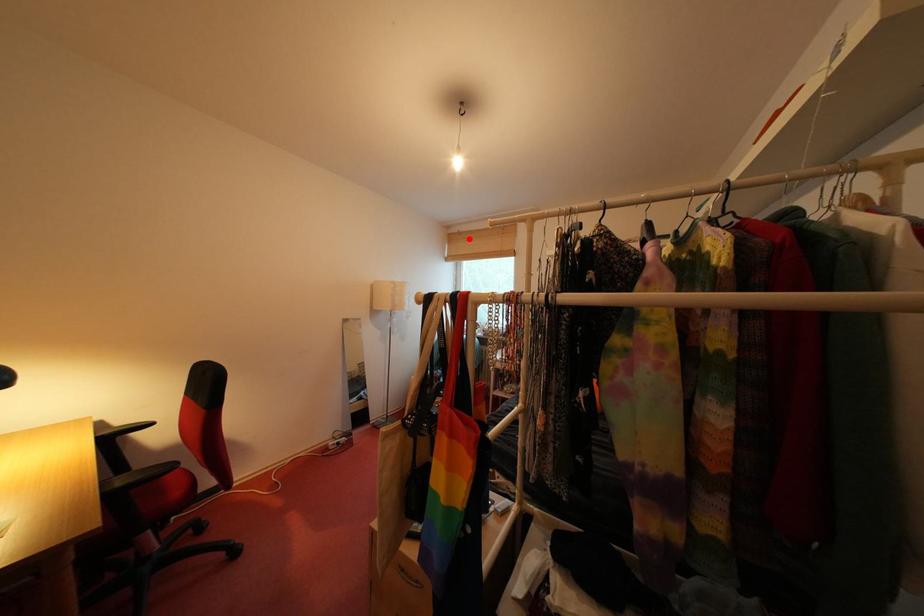
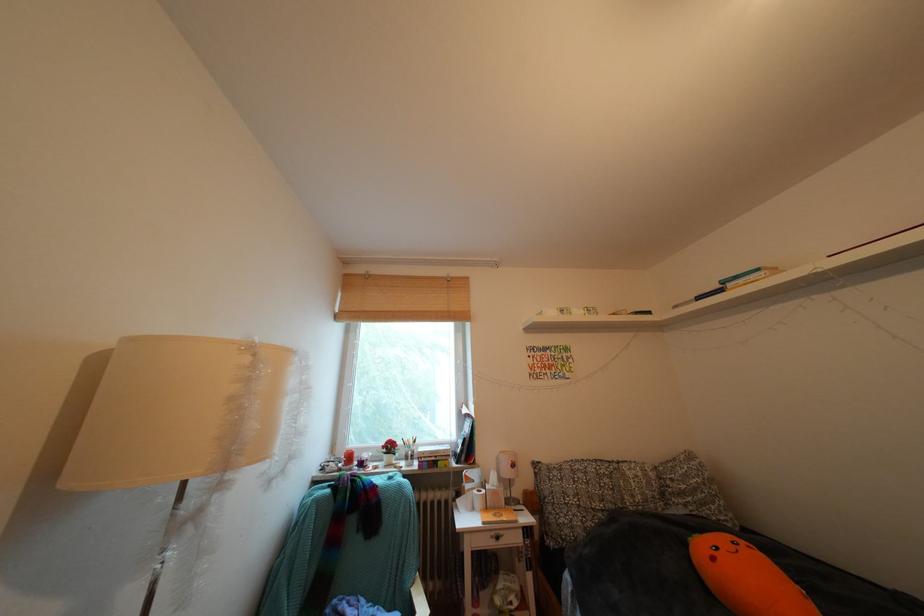
Question: I am providing you with two images of the same scene from different viewpoints. Given a red point in image1, look at the same physical point in image2. Is it:

Choices:
 (A) Closer to the viewpoint
 (B) Farther from the viewpoint

Answer: (B)